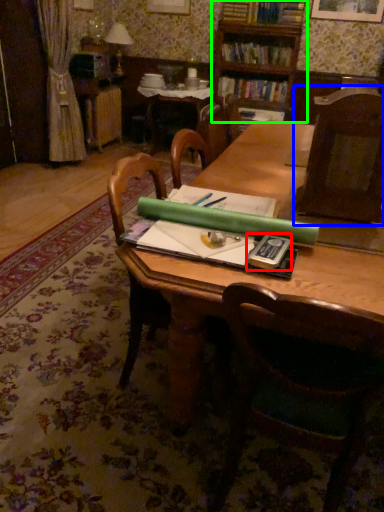
Question: Which is farther away from paperback book (highlighted by a red box)? chair (highlighted by a blue box) or bookcase (highlighted by a green box)?

Choices:
 (A) chair
 (B) bookcase

Answer: (B)